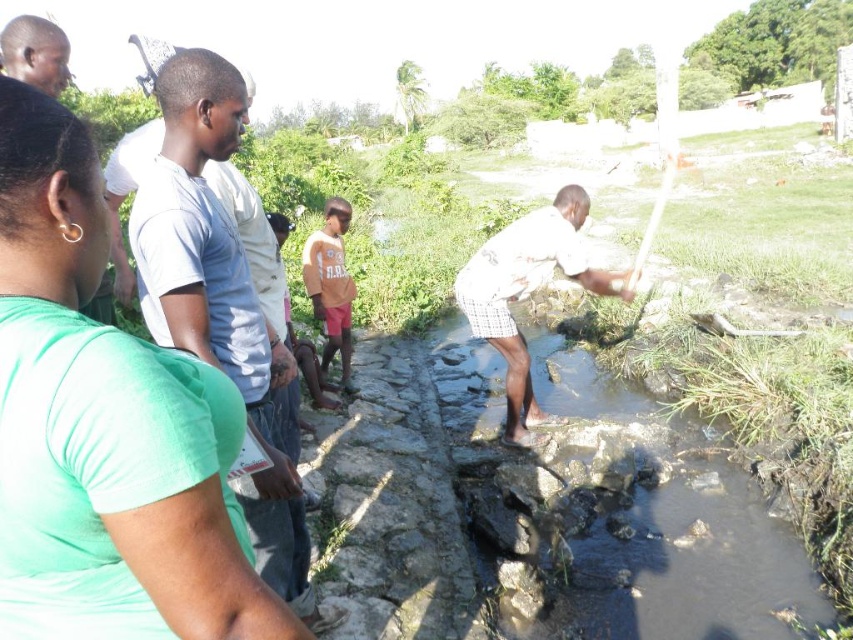
You are standing at the stream and want to place a small marker at both point (733, 492) and point (351, 289). Which point will appear closer to you when you look at the image?

Point (733, 492) is closer to the camera than point (351, 289), so it will appear closer to you in the image.